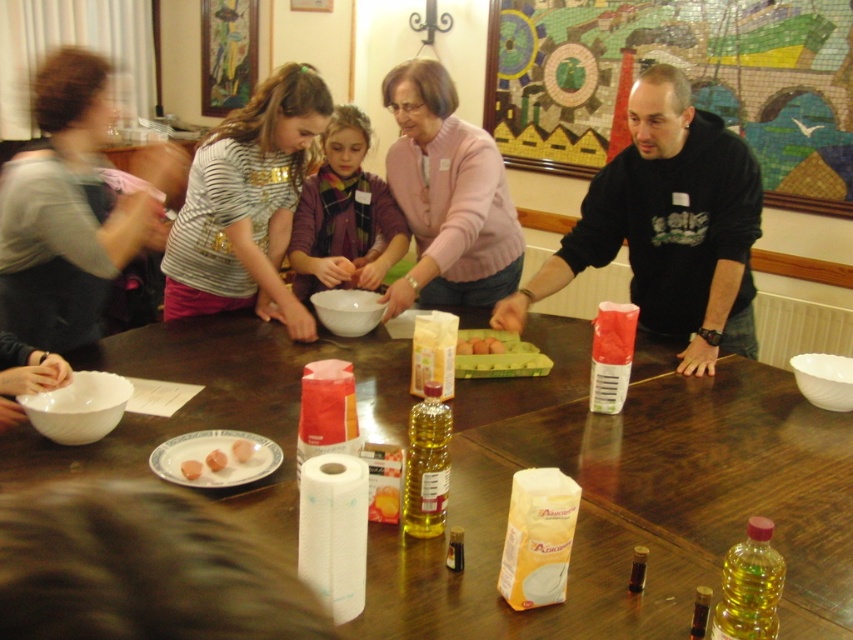
Is striped fabric shirt at center smaller than pink soft-boiled eggs at center?

No, striped fabric shirt at center is not smaller than pink soft-boiled eggs at center.

Does striped fabric shirt at center have a lesser width compared to pink soft-boiled eggs at center?

In fact, striped fabric shirt at center might be wider than pink soft-boiled eggs at center.

Who is more distant from viewer, (x=300, y=65) or (x=221, y=458)?

The point (x=300, y=65) is more distant.

This screenshot has height=640, width=853. In order to click on striped fabric shirt at center in this screenshot , I will do `click(247, 204)`.

Can you confirm if pinkish matte sausages at center is shorter than brown cardboard egg carton at center?

No, pinkish matte sausages at center is not shorter than brown cardboard egg carton at center.

Describe the element at coordinates (242, 449) in the screenshot. The image size is (853, 640). I see `pinkish matte sausages at center` at that location.

In order to click on pinkish matte sausages at center in this screenshot , I will do `click(242, 449)`.

Is pink sweater at center closer to the viewer compared to pink glossy eggs at center?

No, pink sweater at center is further to the viewer.

Is pink sweater at center above pink glossy eggs at center?

Yes, pink sweater at center is above pink glossy eggs at center.

This screenshot has width=853, height=640. What do you see at coordinates (447, 196) in the screenshot?
I see `pink sweater at center` at bounding box center [447, 196].

At what (x,y) coordinates should I click in order to perform the action: click on pink sweater at center. Please return your answer as a coordinate pair (x, y). The width and height of the screenshot is (853, 640). Looking at the image, I should click on (447, 196).